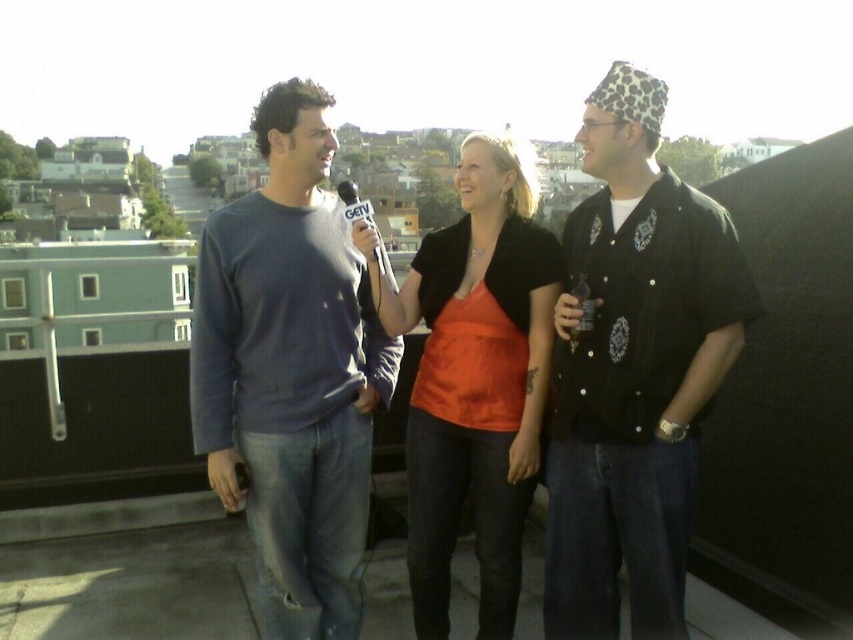
You are an event planner organizing a rooftop event and need to place two shirts on display. The dark blue cotton shirt at center and the matte orange shirt at center must be arranged such that the taller one is placed on a higher shelf. Which shirt should be placed on the higher shelf?

The dark blue cotton shirt at center has a greater height compared to the matte orange shirt at center, so it should be placed on the higher shelf.

You are a photographer trying to capture a group photo of the three individuals on the rooftop. You need to position yourself so that the dark blue cotton shirt at center is framed exactly at the center of your camera viewfinder. Given that the camera viewfinder has a width of 1 unit, what should be the horizontal coordinate range you should adjust your camera to focus on?

The dark blue cotton shirt at center is positioned at point 0.581 on the horizontal axis. To center it in the viewfinder, the horizontal coordinate range should be from 0.581 minus half the viewfinder width to 0.581 plus half the viewfinder width. Since the viewfinder width is 1 unit, half of that is 0.5. Therefore, the range is from 0.581 0.5 to 0.581 0.5. Wait, but coordinates can be negative? Hmm, maybe I need to check the calculation again. Let me think. If the shirt is at 0.581, and the viewfinder is 1

You are a photographer trying to capture a clear shot of both the dark blue cotton shirt at center and the white plastic microphone at center. Which object should you focus on first to ensure both are in focus?

The dark blue cotton shirt at center is positioned under the white plastic microphone at center, so focusing on the white plastic microphone at center first will ensure both are in focus since it is closer to the camera.